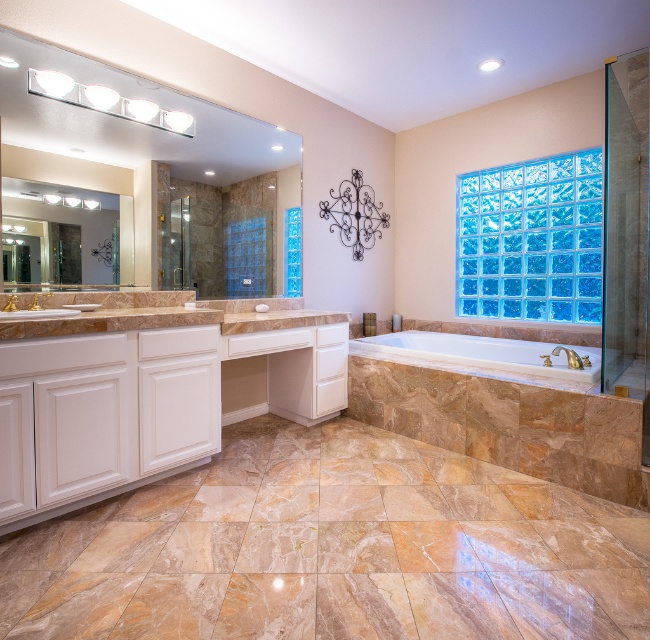
Does matte glass mirror at upper left have a lesser height compared to metallic wrought iron chandelier at upper center?

Incorrect, matte glass mirror at upper left's height does not fall short of metallic wrought iron chandelier at upper center's.

Between matte glass mirror at upper left and metallic wrought iron chandelier at upper center, which one appears on the left side from the viewer's perspective?

matte glass mirror at upper left is more to the left.

Is point (20, 83) positioned before point (344, 228)?

Yes.

The image size is (650, 640). I want to click on matte glass mirror at upper left, so click(131, 120).

Between blue glass block wall at upper right and gold metallic faucet at center, which one is positioned lower?

gold metallic faucet at center

Describe the element at coordinates (530, 240) in the screenshot. This screenshot has height=640, width=650. I see `blue glass block wall at upper right` at that location.

Does point (494, 182) lie in front of point (10, 305)?

No.

Identify the location of blue glass block wall at upper right. This screenshot has width=650, height=640. (530, 240).

At what (x,y) coordinates should I click in order to perform the action: click on matte white sink at left. Please return your answer as a coordinate pair (x, y). Looking at the image, I should click on [32, 310].

In the scene shown: Can you confirm if matte white sink at left is bigger than gold metallic faucet at lower right?

Yes, matte white sink at left is bigger than gold metallic faucet at lower right.

Between point (13, 298) and point (569, 360), which one is positioned in front?

Point (13, 298) is more forward.

The image size is (650, 640). In order to click on matte white sink at left in this screenshot , I will do `click(32, 310)`.